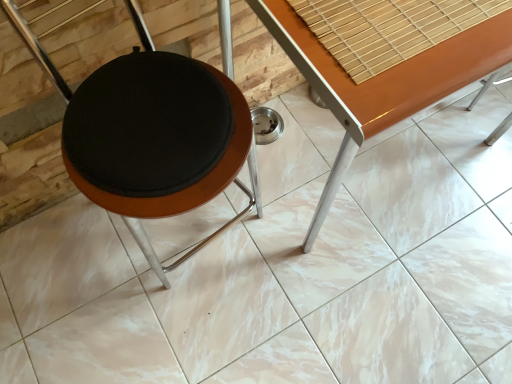
Question: Is wooden glossy table at center positioned with its back to matte black stool at center?

Choices:
 (A) no
 (B) yes

Answer: (A)

Question: Is wooden glossy table at center shorter than matte black stool at center?

Choices:
 (A) no
 (B) yes

Answer: (B)

Question: Is wooden glossy table at center further to camera compared to matte black stool at center?

Choices:
 (A) no
 (B) yes

Answer: (B)

Question: From a real-world perspective, is wooden glossy table at center below matte black stool at center?

Choices:
 (A) yes
 (B) no

Answer: (A)

Question: Considering the relative sizes of wooden glossy table at center and matte black stool at center in the image provided, is wooden glossy table at center wider than matte black stool at center?

Choices:
 (A) yes
 (B) no

Answer: (A)

Question: Is wooden glossy table at center outside matte black stool at center?

Choices:
 (A) no
 (B) yes

Answer: (B)

Question: Does matte black stool at center have a smaller size compared to wooden glossy table at center?

Choices:
 (A) yes
 (B) no

Answer: (A)

Question: Does matte black stool at center have a lesser width compared to wooden glossy table at center?

Choices:
 (A) no
 (B) yes

Answer: (B)

Question: Is matte black stool at center placed right next to wooden glossy table at center?

Choices:
 (A) no
 (B) yes

Answer: (A)

Question: Can you confirm if matte black stool at center is positioned to the left of wooden glossy table at center?

Choices:
 (A) no
 (B) yes

Answer: (B)

Question: From a real-world perspective, is matte black stool at center over wooden glossy table at center?

Choices:
 (A) yes
 (B) no

Answer: (A)

Question: From a real-world perspective, is matte black stool at center located beneath wooden glossy table at center?

Choices:
 (A) yes
 (B) no

Answer: (B)

Question: Would you say matte black stool at center is to the left or to the right of wooden glossy table at center in the picture?

Choices:
 (A) right
 (B) left

Answer: (B)